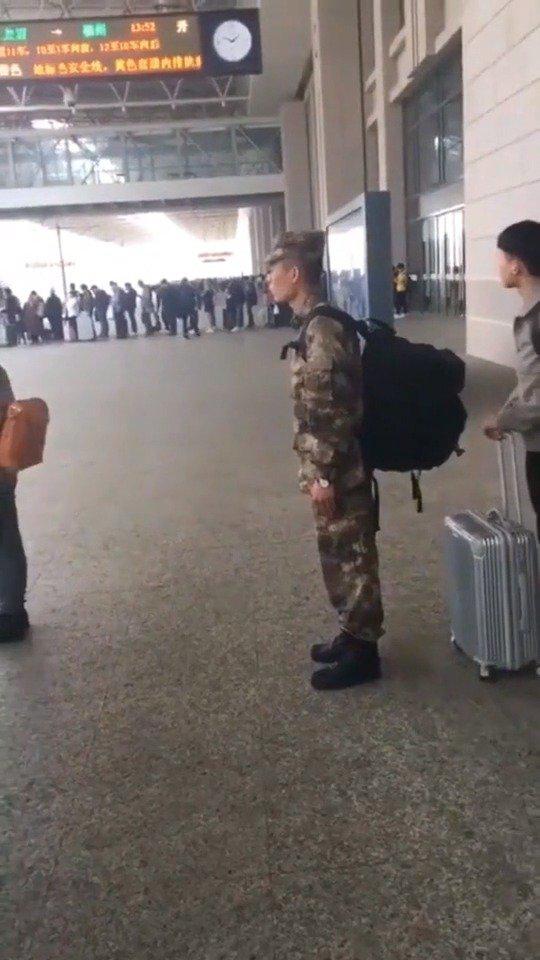
The image size is (540, 960). Identify the location of tile floor. (214, 601).